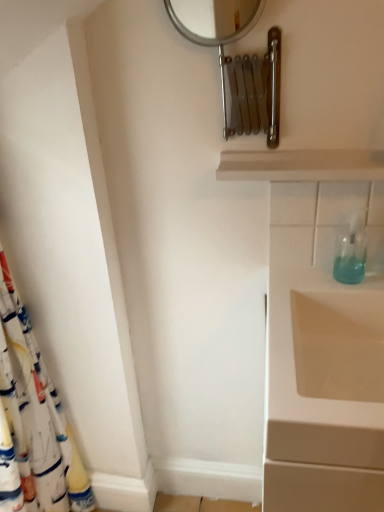
What do you see at coordinates (42, 398) in the screenshot? I see `white fabric shower curtain at left` at bounding box center [42, 398].

Where is `white fabric shower curtain at left`? Image resolution: width=384 pixels, height=512 pixels. white fabric shower curtain at left is located at coordinates (42, 398).

What is the approximate width of silver metallic mirror at upper center?

The width of silver metallic mirror at upper center is 3.29 centimeters.

Describe the element at coordinates (301, 165) in the screenshot. This screenshot has width=384, height=512. I see `white wood shelf at upper center` at that location.

What do you see at coordinates (351, 251) in the screenshot?
I see `transparent plastic soap dispenser at right` at bounding box center [351, 251].

Where is `white fabric shower curtain at left`? This screenshot has width=384, height=512. white fabric shower curtain at left is located at coordinates (42, 398).

Is white fabric shower curtain at left next to silver metallic mirror at upper center?

They are not placed beside each other.

Which object is positioned more to the right, white fabric shower curtain at left or silver metallic mirror at upper center?

silver metallic mirror at upper center is more to the right.

Identify the location of mirror that appears above the white fabric shower curtain at left (from a real-world perspective). (210, 29).

In the image, is white fabric shower curtain at left positioned in front of or behind silver metallic mirror at upper center?

Clearly, white fabric shower curtain at left is behind silver metallic mirror at upper center.

Which object is positioned more to the left, white wood shelf at upper center or transparent plastic soap dispenser at right?

Positioned to the left is white wood shelf at upper center.

From a real-world perspective, is white wood shelf at upper center on top of transparent plastic soap dispenser at right?

Correct, in the physical world, white wood shelf at upper center is higher than transparent plastic soap dispenser at right.

Can you see white wood shelf at upper center touching transparent plastic soap dispenser at right?

No, white wood shelf at upper center is not making contact with transparent plastic soap dispenser at right.

Based on the photo, is white wood shelf at upper center located outside transparent plastic soap dispenser at right?

Yes, white wood shelf at upper center is located beyond the bounds of transparent plastic soap dispenser at right.

Are silver metallic mirror at upper center and white wood shelf at upper center located far from each other?

They are positioned close to each other.

Looking at this image, can you confirm if silver metallic mirror at upper center is taller than white wood shelf at upper center?

Correct, silver metallic mirror at upper center is much taller as white wood shelf at upper center.

Which of these two, silver metallic mirror at upper center or white wood shelf at upper center, is bigger?

silver metallic mirror at upper center.

Can you confirm if transparent plastic soap dispenser at right is positioned to the right of white wood shelf at upper center?

Correct, you'll find transparent plastic soap dispenser at right to the right of white wood shelf at upper center.

Which point is more forward, (342, 234) or (236, 177)?

The point (236, 177) is closer.

Which object is more forward, transparent plastic soap dispenser at right or white wood shelf at upper center?

white wood shelf at upper center.

Is the depth of silver metallic mirror at upper center greater than that of transparent plastic soap dispenser at right?

No, silver metallic mirror at upper center is closer to the viewer.

Is silver metallic mirror at upper center at the left side of transparent plastic soap dispenser at right?

Indeed, silver metallic mirror at upper center is positioned on the left side of transparent plastic soap dispenser at right.

Can you see silver metallic mirror at upper center touching transparent plastic soap dispenser at right?

No, silver metallic mirror at upper center is not with transparent plastic soap dispenser at right.

Which is correct: silver metallic mirror at upper center is inside transparent plastic soap dispenser at right, or outside of it?

The correct answer is: outside.

Between white fabric shower curtain at left and transparent plastic soap dispenser at right, which one has larger size?

white fabric shower curtain at left.

Considering the sizes of white fabric shower curtain at left and transparent plastic soap dispenser at right in the image, is white fabric shower curtain at left wider or thinner than transparent plastic soap dispenser at right?

Considering their sizes, white fabric shower curtain at left looks broader than transparent plastic soap dispenser at right.

Considering the positions of objects white fabric shower curtain at left and transparent plastic soap dispenser at right in the image provided, who is more to the right, white fabric shower curtain at left or transparent plastic soap dispenser at right?

transparent plastic soap dispenser at right is more to the right.

Looking at this image, from the image's perspective, is white fabric shower curtain at left on transparent plastic soap dispenser at right?

No.

Is white wood shelf at upper center located outside white fabric shower curtain at left?

Yes, white wood shelf at upper center is not within white fabric shower curtain at left.

Looking at this image, is white wood shelf at upper center oriented away from white fabric shower curtain at left?

No, white wood shelf at upper center is not facing the opposite direction of white fabric shower curtain at left.

Which point is more forward, (x=307, y=177) or (x=94, y=503)?

Point (x=307, y=177)

From the image's perspective, which object appears higher, white wood shelf at upper center or white fabric shower curtain at left?

white wood shelf at upper center, from the image's perspective.

Find the location of a particular element. shower curtain that appears behind the silver metallic mirror at upper center is located at coordinates (42, 398).

The image size is (384, 512). I want to click on balustrade above the transparent plastic soap dispenser at right (from the image's perspective), so click(301, 165).

Based on their spatial positions, is silver metallic mirror at upper center or white wood shelf at upper center closer to transparent plastic soap dispenser at right?

Among the two, white wood shelf at upper center is located nearer to transparent plastic soap dispenser at right.

Estimate the real-world distances between objects in this image. Which object is further from silver metallic mirror at upper center, white wood shelf at upper center or white fabric shower curtain at left?

Among the two, white fabric shower curtain at left is located further to silver metallic mirror at upper center.

When comparing their distances from silver metallic mirror at upper center, does transparent plastic soap dispenser at right or white fabric shower curtain at left seem further?

The object further to silver metallic mirror at upper center is white fabric shower curtain at left.

In the scene shown: Based on their spatial positions, is silver metallic mirror at upper center or white wood shelf at upper center closer to white fabric shower curtain at left?

white wood shelf at upper center.

From the image, which object appears to be nearer to white wood shelf at upper center, silver metallic mirror at upper center or white fabric shower curtain at left?

silver metallic mirror at upper center.

When comparing their distances from white fabric shower curtain at left, does silver metallic mirror at upper center or transparent plastic soap dispenser at right seem further?

transparent plastic soap dispenser at right is positioned further to the anchor white fabric shower curtain at left.

Estimate the real-world distances between objects in this image. Which object is further from white wood shelf at upper center, transparent plastic soap dispenser at right or white fabric shower curtain at left?

white fabric shower curtain at left is positioned further to the anchor white wood shelf at upper center.

Looking at the image, which one is located closer to transparent plastic soap dispenser at right, white fabric shower curtain at left or silver metallic mirror at upper center?

Based on the image, silver metallic mirror at upper center appears to be nearer to transparent plastic soap dispenser at right.

Image resolution: width=384 pixels, height=512 pixels. In order to click on mirror between white fabric shower curtain at left and transparent plastic soap dispenser at right in the horizontal direction in this screenshot , I will do `click(210, 29)`.

Locate an element on the screen. Image resolution: width=384 pixels, height=512 pixels. balustrade situated between white fabric shower curtain at left and transparent plastic soap dispenser at right from left to right is located at coordinates (301, 165).

At what (x,y) coordinates should I click in order to perform the action: click on balustrade between silver metallic mirror at upper center and white fabric shower curtain at left vertically. Please return your answer as a coordinate pair (x, y). Looking at the image, I should click on (301, 165).

This screenshot has height=512, width=384. I want to click on balustrade between silver metallic mirror at upper center and transparent plastic soap dispenser at right from top to bottom, so click(301, 165).